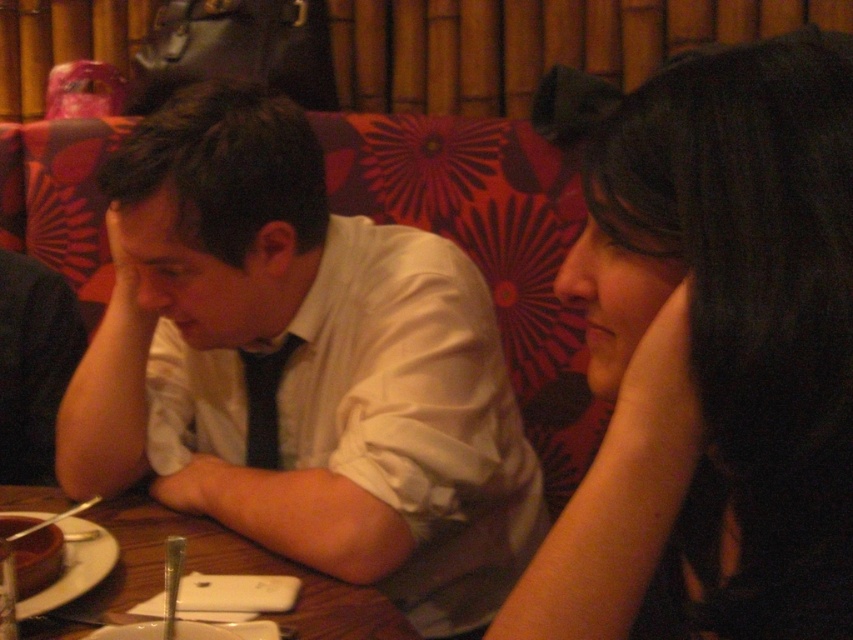
Is white satin shirt at center wider than wooden table at center?

Yes.

The width and height of the screenshot is (853, 640). What do you see at coordinates (300, 369) in the screenshot?
I see `white satin shirt at center` at bounding box center [300, 369].

Locate an element on the screen. The height and width of the screenshot is (640, 853). white satin shirt at center is located at coordinates (300, 369).

What do you see at coordinates (712, 349) in the screenshot?
I see `black hair at upper right` at bounding box center [712, 349].

Find the location of a particular element. black hair at upper right is located at coordinates (712, 349).

Is point (582, 636) positioned in front of point (39, 497)?

Yes.

At what (x,y) coordinates should I click in order to perform the action: click on black hair at upper right. Please return your answer as a coordinate pair (x, y). Looking at the image, I should click on (712, 349).

Looking at this image, who is shorter, wooden table at center or chocolate cake at lower left?

Standing shorter between the two is chocolate cake at lower left.

Who is taller, wooden table at center or chocolate cake at lower left?

→ wooden table at center

The height and width of the screenshot is (640, 853). Describe the element at coordinates (215, 572) in the screenshot. I see `wooden table at center` at that location.

Locate an element on the screen. wooden table at center is located at coordinates (215, 572).